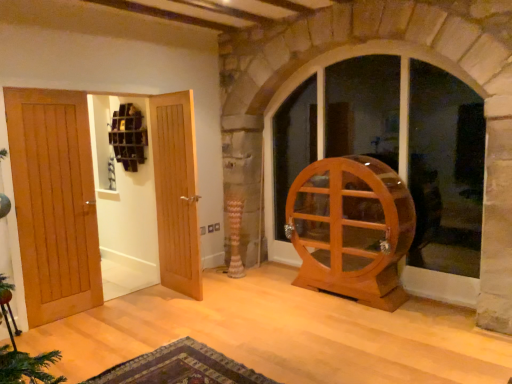
Question: From a real-world perspective, does carpeted rug at lower center sit lower than light brown wood hamster wheel at right?

Choices:
 (A) no
 (B) yes

Answer: (B)

Question: Are carpeted rug at lower center and light brown wood hamster wheel at right far apart?

Choices:
 (A) no
 (B) yes

Answer: (B)

Question: From the image's perspective, is carpeted rug at lower center below light brown wood hamster wheel at right?

Choices:
 (A) yes
 (B) no

Answer: (A)

Question: Is carpeted rug at lower center facing towards light brown wood hamster wheel at right?

Choices:
 (A) no
 (B) yes

Answer: (A)

Question: Does carpeted rug at lower center have a lesser height compared to light brown wood hamster wheel at right?

Choices:
 (A) no
 (B) yes

Answer: (B)

Question: Is the depth of carpeted rug at lower center less than that of light brown wood hamster wheel at right?

Choices:
 (A) no
 (B) yes

Answer: (B)

Question: Does carpeted rug at lower center have a smaller size compared to light brown wood door at left, positioned as the 2th door in left-to-right order?

Choices:
 (A) yes
 (B) no

Answer: (A)

Question: Does carpeted rug at lower center appear on the right side of light brown wood door at left, positioned as the 2th door in left-to-right order?

Choices:
 (A) no
 (B) yes

Answer: (B)

Question: Is carpeted rug at lower center taller than light brown wood door at left, positioned as the 2th door in left-to-right order?

Choices:
 (A) no
 (B) yes

Answer: (A)

Question: Is carpeted rug at lower center closer to the viewer compared to light brown wood door at left, positioned as the 2th door in left-to-right order?

Choices:
 (A) no
 (B) yes

Answer: (B)

Question: Can you confirm if carpeted rug at lower center is thinner than light brown wood door at left, positioned as the 2th door in left-to-right order?

Choices:
 (A) no
 (B) yes

Answer: (A)

Question: From a real-world perspective, is carpeted rug at lower center over light brown wood door at left, which appears as the 2th door when viewed from the right?

Choices:
 (A) no
 (B) yes

Answer: (A)

Question: From a real-world perspective, is light brown wood door at left, positioned as the 2th door in left-to-right order, positioned over light brown wood door at center, marked as the 1th door in a right-to-left arrangement, based on gravity?

Choices:
 (A) no
 (B) yes

Answer: (B)